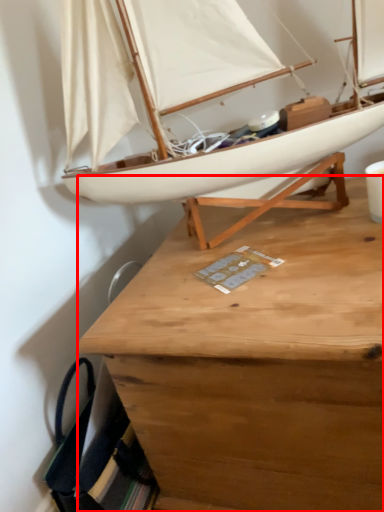
Question: From the image's perspective, where is desk (annotated by the red box) located relative to boat?

Choices:
 (A) below
 (B) above

Answer: (A)